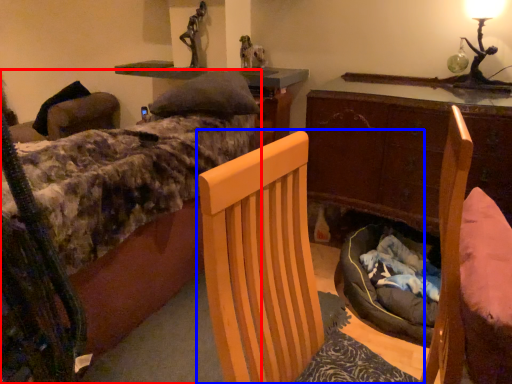
Question: Among these objects, which one is farthest to the camera, bed (highlighted by a red box) or chair (highlighted by a blue box)?

Choices:
 (A) bed
 (B) chair

Answer: (A)